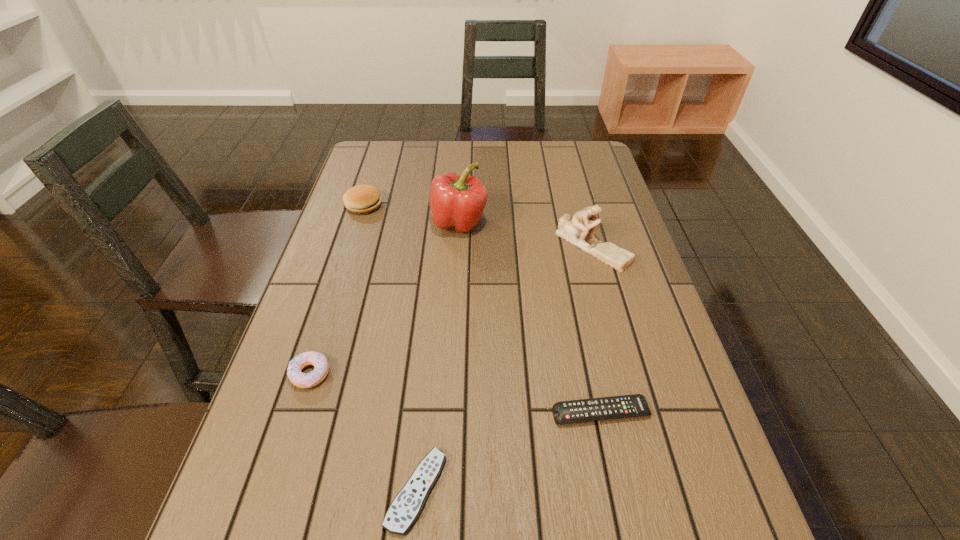
The width and height of the screenshot is (960, 540). In order to click on free space at the left edge in this screenshot , I will do click(x=341, y=354).

The width and height of the screenshot is (960, 540). I want to click on free region at the right edge of the desktop, so click(x=606, y=220).

At what (x,y) coordinates should I click in order to perform the action: click on vacant area at the far left corner of the desktop. Please return your answer as a coordinate pair (x, y). Looking at the image, I should click on (395, 151).

Locate an element on the screen. Image resolution: width=960 pixels, height=540 pixels. free space between the fifth shortest object and the farther remote control is located at coordinates (597, 329).

Where is `empty space that is in between the left remote control and the fifth farthest object`? empty space that is in between the left remote control and the fifth farthest object is located at coordinates (509, 451).

Locate an element on the screen. The image size is (960, 540). vacant point located between the second tallest object and the farther remote control is located at coordinates (597, 329).

Locate an element on the screen. This screenshot has width=960, height=540. free point between the fifth shortest object and the tallest object is located at coordinates (525, 234).

The width and height of the screenshot is (960, 540). What are the coordinates of `vacant space that is in between the patty and the third shortest object` in the screenshot? It's located at (337, 289).

The height and width of the screenshot is (540, 960). What are the coordinates of `unoccupied area between the tallest object and the patty` in the screenshot? It's located at (411, 214).

The width and height of the screenshot is (960, 540). Find the location of `vacant point located between the doughnut and the figurine`. vacant point located between the doughnut and the figurine is located at coordinates (451, 309).